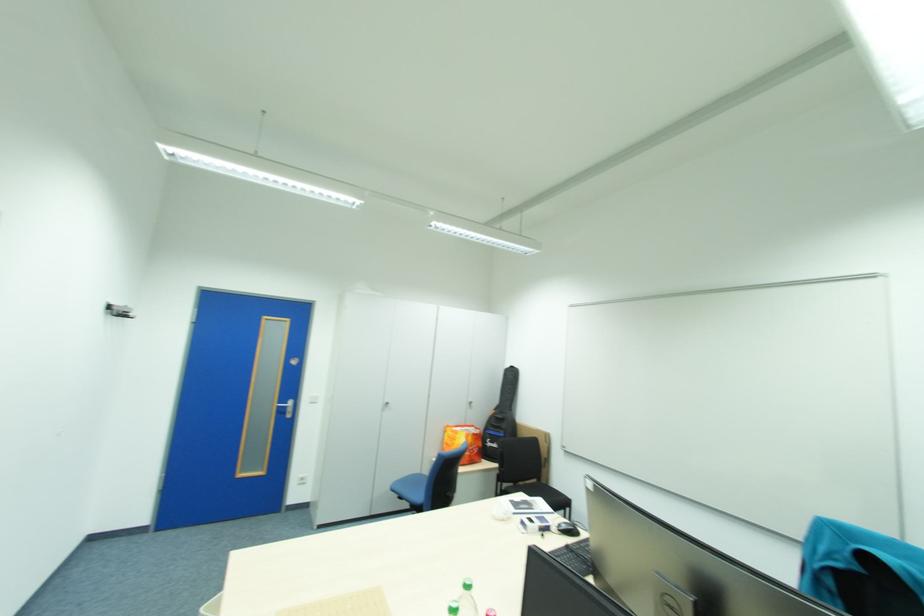
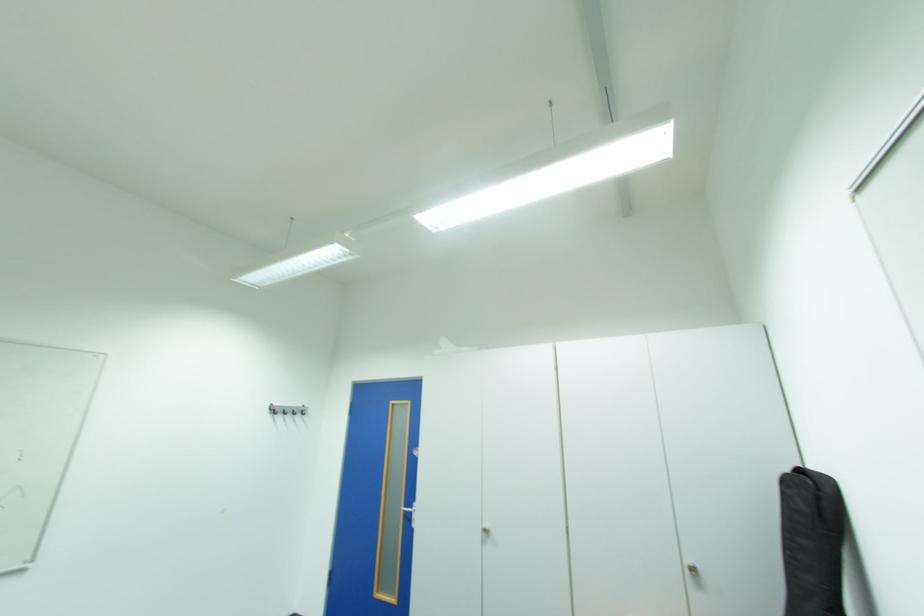
In the second image, find the point that corresponds to [515,370] in the first image.

(795, 482)